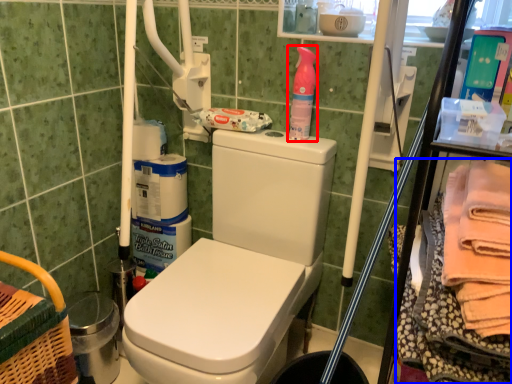
Question: Which of the following is the farthest to the observer, cleaning product (highlighted by a red box) or material (highlighted by a blue box)?

Choices:
 (A) cleaning product
 (B) material

Answer: (A)